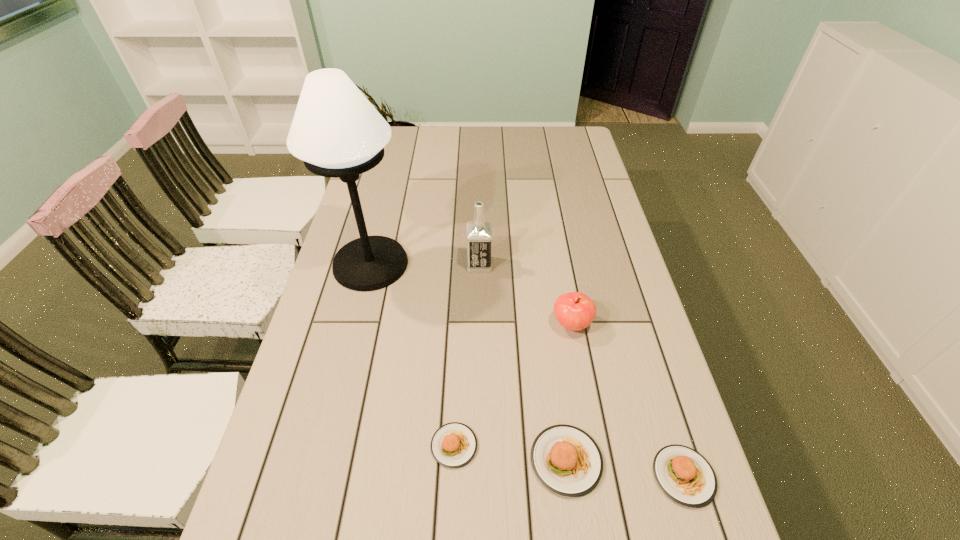
Where is `the leftmost object`? This screenshot has height=540, width=960. the leftmost object is located at coordinates (336, 131).

In order to click on vacant space situated 0.380m on the right of the leftmost food in this screenshot , I will do `click(655, 446)`.

Identify the location of free location located 0.100m on the left of the tallest food. This screenshot has width=960, height=540. (483, 461).

At what (x,y) coordinates should I click in order to perform the action: click on blank space located 0.400m on the left of the fifth tallest object. Please return your answer as a coordinate pair (x, y). This screenshot has width=960, height=540. Looking at the image, I should click on (457, 476).

Where is `free location located 0.150m on the front label of the vodka`? The image size is (960, 540). free location located 0.150m on the front label of the vodka is located at coordinates (541, 265).

The height and width of the screenshot is (540, 960). Identify the location of vacant space located on the left of the fourth nearest object. (532, 325).

Where is `vacant space located 0.140m on the back of the table lamp`? vacant space located 0.140m on the back of the table lamp is located at coordinates (384, 212).

Where is `object that is at the left edge`? object that is at the left edge is located at coordinates click(x=336, y=131).

I want to click on food present at the right edge, so click(x=684, y=475).

Where is `apple situated at the right edge`? apple situated at the right edge is located at coordinates (575, 311).